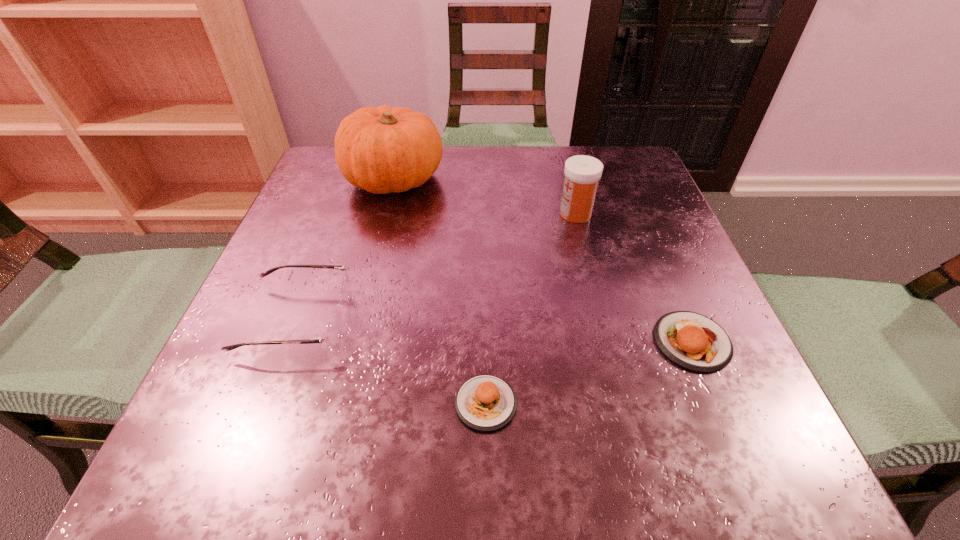
Identify the location of blank region between the third tallest object and the rightmost object. (494, 330).

The height and width of the screenshot is (540, 960). I want to click on free spot between the pumpkin and the fourth object from left to right, so click(485, 196).

Locate an element on the screen. The height and width of the screenshot is (540, 960). vacant point located between the pumpkin and the left food is located at coordinates (440, 291).

You are a GUI agent. You are given a task and a screenshot of the screen. Output one action in this format:
    pyautogui.click(x=<x>, y=<y>)
    Task: Click on the free area in between the left food and the medicine
    
    Given the screenshot: What is the action you would take?
    pyautogui.click(x=531, y=308)

Locate an element on the screen. This screenshot has width=960, height=540. vacant region between the nearer food and the tallest object is located at coordinates (440, 291).

Identify the location of vacant space in between the tallest object and the taller food. (543, 260).

Where is `free space that is in between the tallest object and the fourth object from left to right`? Image resolution: width=960 pixels, height=540 pixels. free space that is in between the tallest object and the fourth object from left to right is located at coordinates (485, 196).

At what (x,y) coordinates should I click in order to perform the action: click on object that is the fourth nearest to the shortest object. Please return your answer as a coordinate pair (x, y). The width and height of the screenshot is (960, 540). Looking at the image, I should click on (381, 150).

Image resolution: width=960 pixels, height=540 pixels. Identify the location of object identified as the second closest to the rightmost object. coord(582,173).

Image resolution: width=960 pixels, height=540 pixels. In order to click on vacant space that satisfies the following two spatial constraints: 1. on the front side of the nearer food; 2. on the left side of the tallest object in this screenshot , I will do `click(338, 403)`.